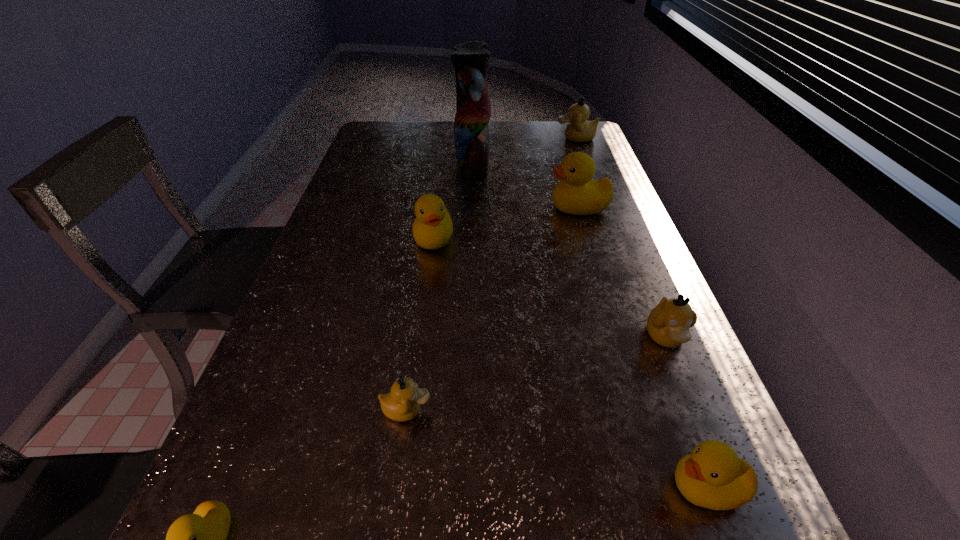
This screenshot has width=960, height=540. I want to click on vacant space at the right edge of the desktop, so click(634, 282).

Where is `blank space at the far left corner`? The image size is (960, 540). blank space at the far left corner is located at coordinates (x=395, y=127).

This screenshot has height=540, width=960. In the image, there is a desktop. What are the coordinates of `free space at the far right corner` in the screenshot? It's located at (570, 141).

The width and height of the screenshot is (960, 540). I want to click on vacant point located between the fourth farthest duckling and the parrot, so click(569, 249).

Where is `vacant area that lies between the fifth farthest object and the third farthest duckling`? Image resolution: width=960 pixels, height=540 pixels. vacant area that lies between the fifth farthest object and the third farthest duckling is located at coordinates (549, 288).

Identify the location of vacant area between the second biggest tan duckling and the second farthest duckling. (622, 272).

You are a GUI agent. You are given a task and a screenshot of the screen. Output one action in this format:
    pyautogui.click(x=<x>, y=<y>)
    Task: Click on the unoccupied position between the tallest object and the biggest tan duckling
    Image resolution: width=960 pixels, height=540 pixels.
    Given the screenshot: What is the action you would take?
    pyautogui.click(x=524, y=150)

In order to click on free space between the leftmost tan duckling and the farthest tan duckling in this screenshot , I will do `click(492, 274)`.

Where is `vacant region between the biggest tan duckling and the third yellow duckling from right to left`? vacant region between the biggest tan duckling and the third yellow duckling from right to left is located at coordinates (505, 188).

At what (x,y) coordinates should I click in order to perform the action: click on vacant area that lies between the parrot and the fifth nearest duckling. Please return your answer as a coordinate pair (x, y). The image size is (960, 540). Looking at the image, I should click on (453, 200).